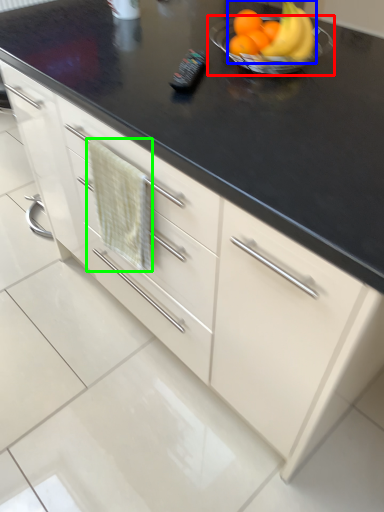
Question: Which object is the farthest from glass bowl (highlighted by a red box)? Choose among these: grapefruit (highlighted by a blue box) or hand towel (highlighted by a green box).

Choices:
 (A) grapefruit
 (B) hand towel

Answer: (B)